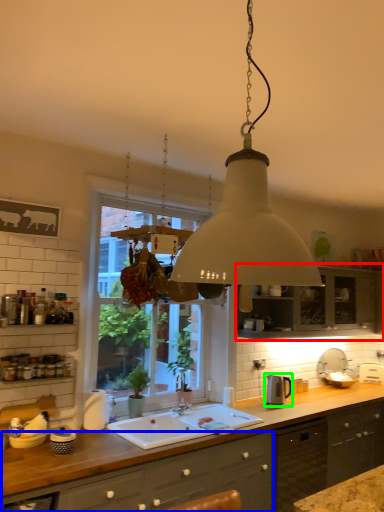
Question: Which is nearer to the cabinetry (highlighted by a red box)? cabinetry (highlighted by a blue box) or appliance (highlighted by a green box).

Choices:
 (A) cabinetry
 (B) appliance

Answer: (B)